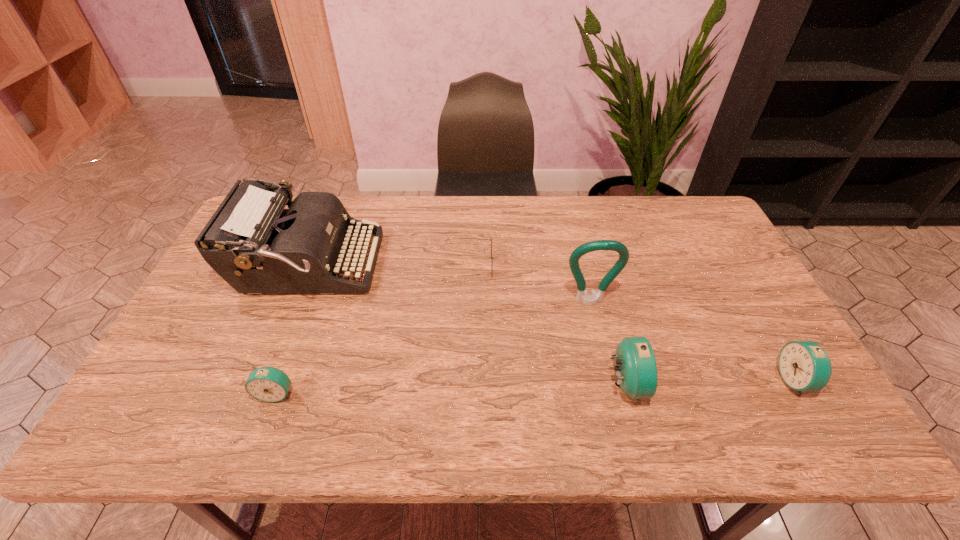
Identify the location of the leftmost alarm clock. The image size is (960, 540). click(x=268, y=384).

I want to click on the fifth tallest object, so click(268, 384).

In order to click on the second alarm clock from left to right in this screenshot , I will do `click(636, 370)`.

You are a GUI agent. You are given a task and a screenshot of the screen. Output one action in this format:
    pyautogui.click(x=<x>, y=<y>)
    Task: Click on the tallest alarm clock
    The image size is (960, 540).
    Given the screenshot: What is the action you would take?
    pyautogui.click(x=636, y=370)

Find the location of a particular element. the rightmost object is located at coordinates (804, 365).

Where is `the fourth tallest object`? The image size is (960, 540). the fourth tallest object is located at coordinates (804, 365).

This screenshot has height=540, width=960. What are the coordinates of `the fourth object from right to left` in the screenshot? It's located at (491, 237).

Find the location of a particular element. The width and height of the screenshot is (960, 540). the shortest object is located at coordinates (491, 237).

Where is `typewriter`? The width and height of the screenshot is (960, 540). typewriter is located at coordinates (252, 242).

You are a GUI agent. You are given a task and a screenshot of the screen. Output one action in this format:
    pyautogui.click(x=<x>, y=<y>)
    Task: Click on the bottle opener
    This screenshot has height=540, width=960.
    Given the screenshot: What is the action you would take?
    pyautogui.click(x=582, y=296)